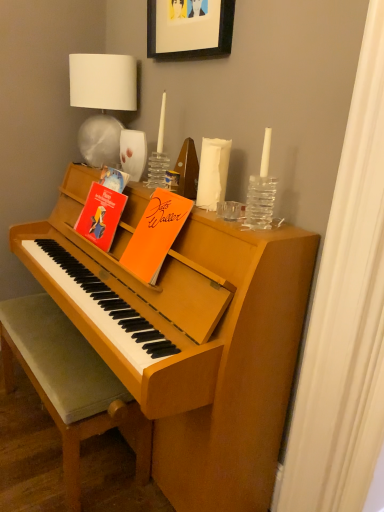
Question: From the image's perspective, is velvet grey cushioned bench at lower left below white fabric lampshade at upper left?

Choices:
 (A) yes
 (B) no

Answer: (A)

Question: Can we say velvet grey cushioned bench at lower left lies outside white fabric lampshade at upper left?

Choices:
 (A) yes
 (B) no

Answer: (A)

Question: Is velvet grey cushioned bench at lower left bigger than white fabric lampshade at upper left?

Choices:
 (A) no
 (B) yes

Answer: (B)

Question: Is velvet grey cushioned bench at lower left facing towards white fabric lampshade at upper left?

Choices:
 (A) no
 (B) yes

Answer: (A)

Question: Is velvet grey cushioned bench at lower left positioned behind white fabric lampshade at upper left?

Choices:
 (A) no
 (B) yes

Answer: (A)

Question: From the image's perspective, is orange matte paper at upper center, the first paperback book positioned from the right, above or below white fabric lampshade at upper left?

Choices:
 (A) below
 (B) above

Answer: (A)

Question: From a real-world perspective, relative to white fabric lampshade at upper left, is orange matte paper at upper center, the first paperback book positioned from the right, vertically above or below?

Choices:
 (A) above
 (B) below

Answer: (B)

Question: Is orange matte paper at upper center, placed as the 2th paperback book when sorted from left to right, inside or outside of white fabric lampshade at upper left?

Choices:
 (A) inside
 (B) outside

Answer: (B)

Question: Relative to white fabric lampshade at upper left, is orange matte paper at upper center, placed as the 2th paperback book when sorted from left to right, in front or behind?

Choices:
 (A) behind
 (B) front

Answer: (B)

Question: Looking at their shapes, would you say velvet grey cushioned bench at lower left is wider or thinner than white fabric lampshade at upper left?

Choices:
 (A) thin
 (B) wide

Answer: (B)

Question: From a real-world perspective, is velvet grey cushioned bench at lower left above or below white fabric lampshade at upper left?

Choices:
 (A) below
 (B) above

Answer: (A)

Question: Considering the positions of velvet grey cushioned bench at lower left and white fabric lampshade at upper left in the image, is velvet grey cushioned bench at lower left bigger or smaller than white fabric lampshade at upper left?

Choices:
 (A) big
 (B) small

Answer: (A)

Question: Is point (1, 328) positioned closer to the camera than point (69, 101)?

Choices:
 (A) closer
 (B) farther

Answer: (A)

Question: Is matte paper book at upper left, the 2th paperback book when ordered from right to left, wider or thinner than white fabric lampshade at upper left?

Choices:
 (A) wide
 (B) thin

Answer: (B)

Question: Considering the positions of matte paper book at upper left, which appears as the first paperback book when viewed from the left, and white fabric lampshade at upper left in the image, is matte paper book at upper left, which appears as the first paperback book when viewed from the left, bigger or smaller than white fabric lampshade at upper left?

Choices:
 (A) small
 (B) big

Answer: (A)